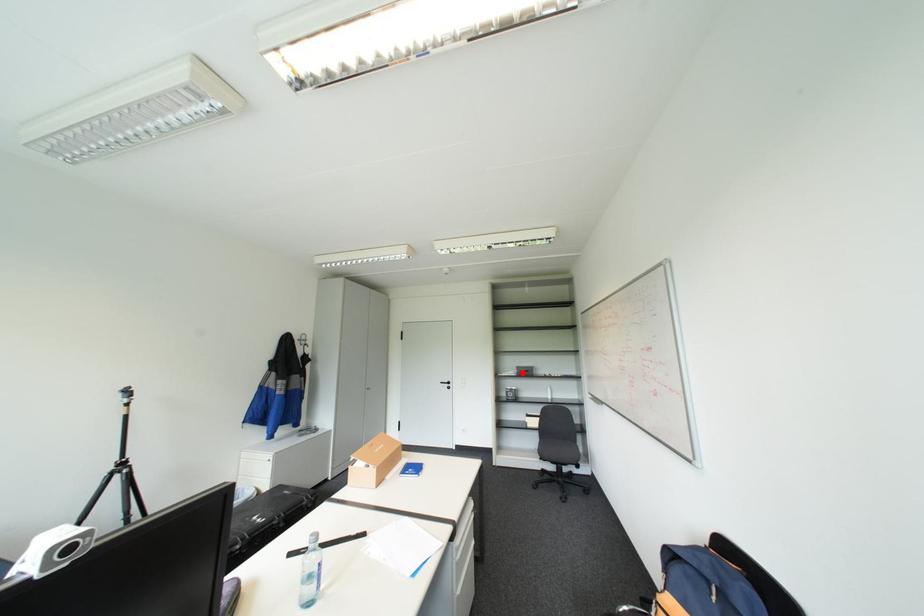
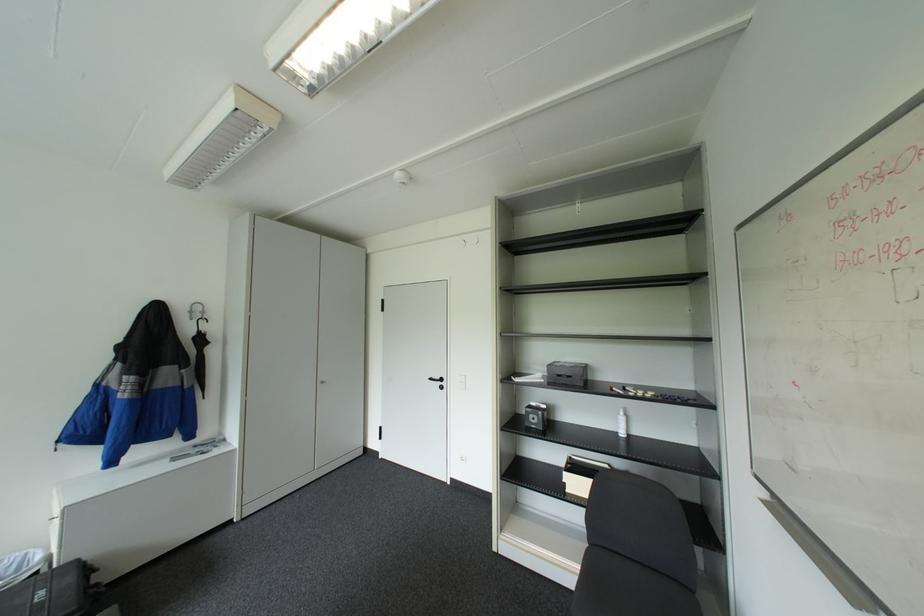
In the second image, find the point that corresponds to the highlighted location in the first image.

(551, 379)